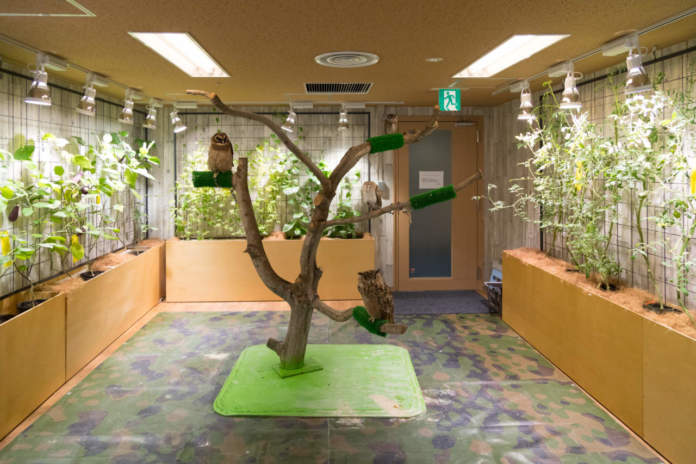
This screenshot has width=696, height=464. I want to click on ceiling, so click(285, 51).